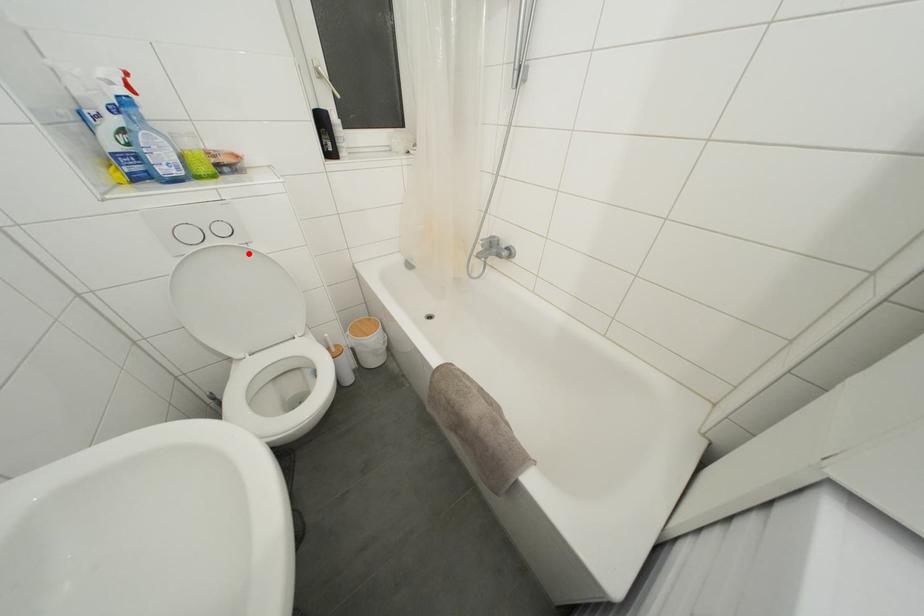
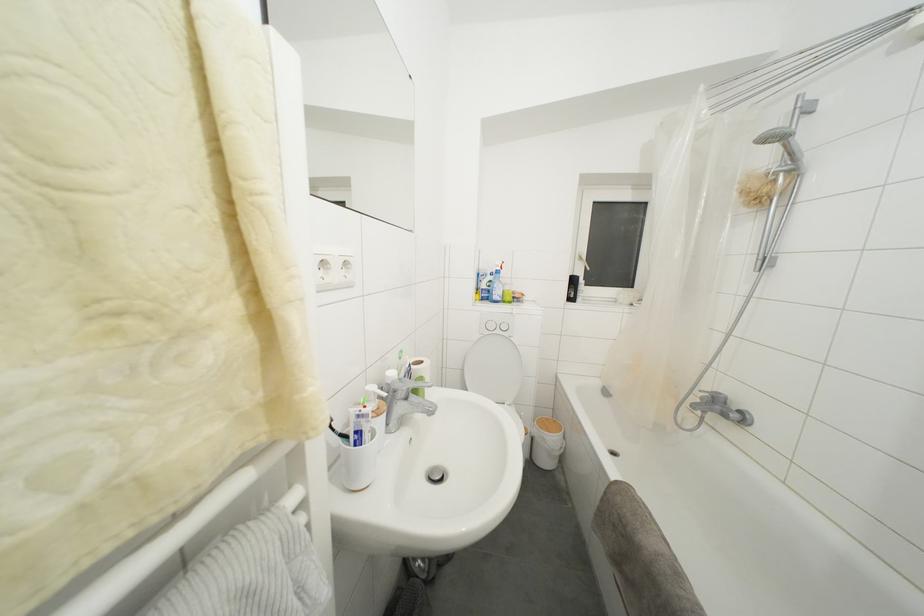
Question: I am providing you with two images of the same scene from different viewpoints. Given a red point in image1, look at the same physical point in image2. Is it:

Choices:
 (A) Closer to the viewpoint
 (B) Farther from the viewpoint

Answer: (B)